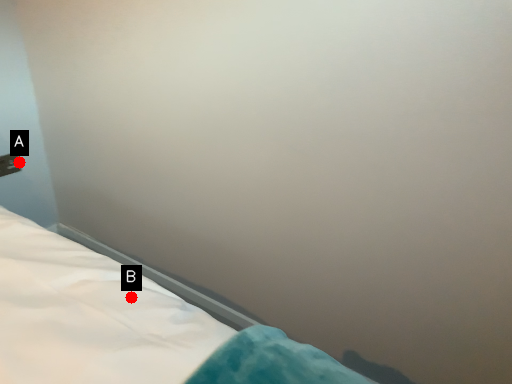
Question: Two points are circled on the image, labeled by A and B beside each circle. Which of the following is the closest to the observer?

Choices:
 (A) A is closer
 (B) B is closer

Answer: (B)